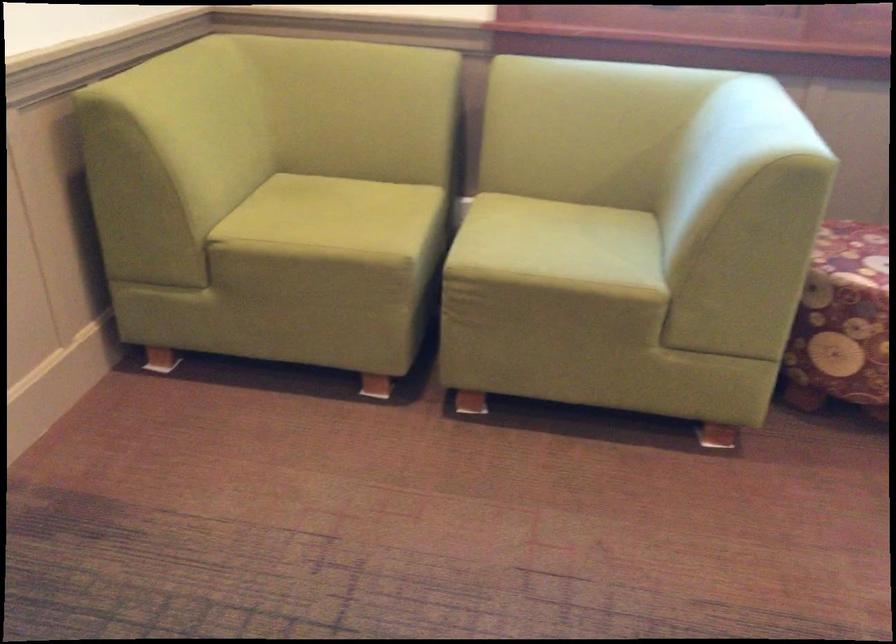
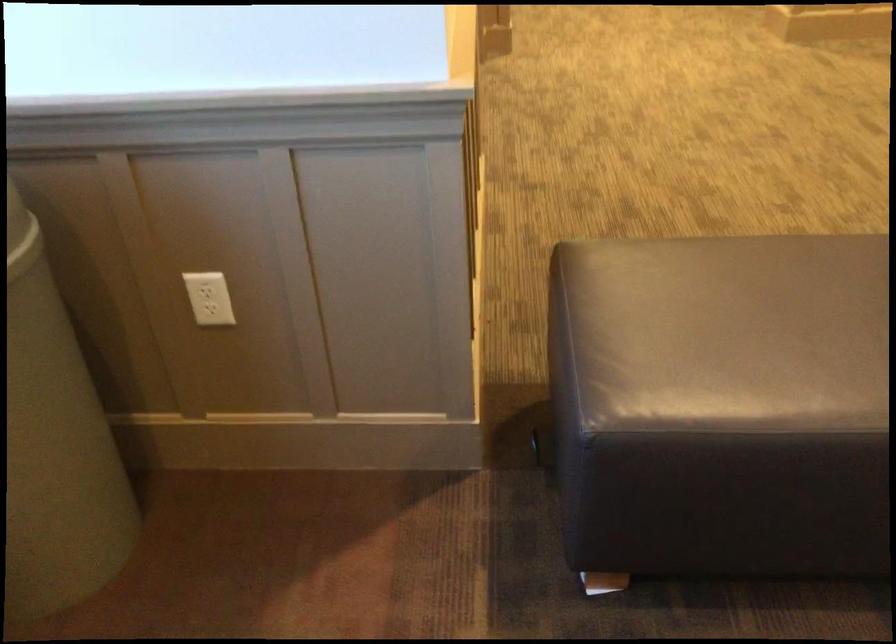
First-person continuous shooting, in which direction is the camera rotating?

The camera rotated toward right-down.